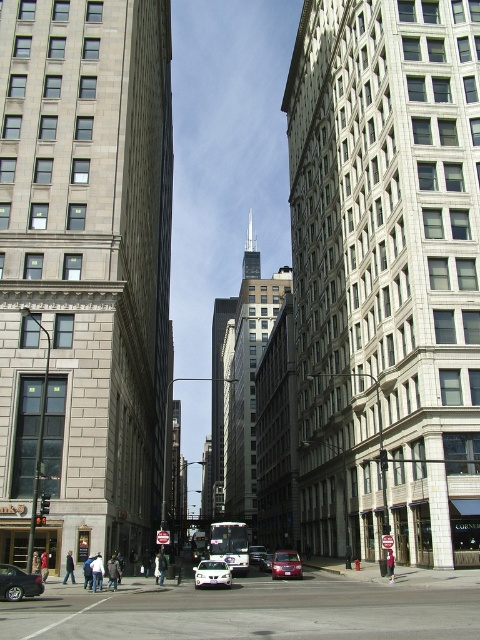
You are a delivery drone that needs to fly from the gray stone building at left to the skyscraper in the background. The minimum safe distance between obstacles for your drone is 40 meters. Can you safely make this flight without getting too close to the building on the right?

The gray stone building at left and the skyscraper in the background are 42.66 meters apart. Since the minimum safe distance is 40 meters, the drone can safely fly between them as the distance is sufficient.

You are a pedestrian standing at the intersection and want to cross the street to reach the skyscraper in the background. There are two cars in your path. The shiny silver sedan at lower left and the metallic silver sedan at center. Which car should you avoid first to safely cross the street?

You should avoid the shiny silver sedan at lower left first because it is closer to the viewer than the metallic silver sedan at center, so it poses an immediate obstacle.

You are a delivery person needing to park your vehicle in this street. You have a shiny silver sedan at lower left and a metallic silver sedan at center in your path. Which vehicle takes up more space on the road?

The metallic silver sedan at center takes up more space on the road because its width is greater than the shiny silver sedan at lower left.